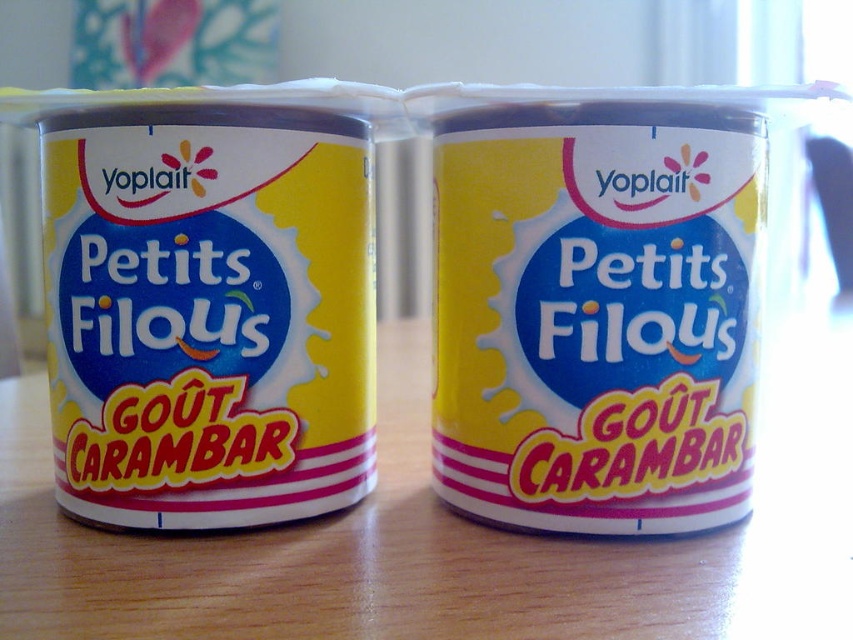
Does yellow matte plastic petits filous at left appear over yellow matte plastic petits filous at center?

Indeed, yellow matte plastic petits filous at left is positioned over yellow matte plastic petits filous at center.

Is yellow matte plastic petits filous at left to the left of yellow matte plastic petits filous at center from the viewer's perspective?

Correct, you'll find yellow matte plastic petits filous at left to the left of yellow matte plastic petits filous at center.

Does point (186, 413) lie in front of point (518, 154)?

No.

Locate an element on the screen. This screenshot has width=853, height=640. yellow matte plastic petits filous at left is located at coordinates (207, 300).